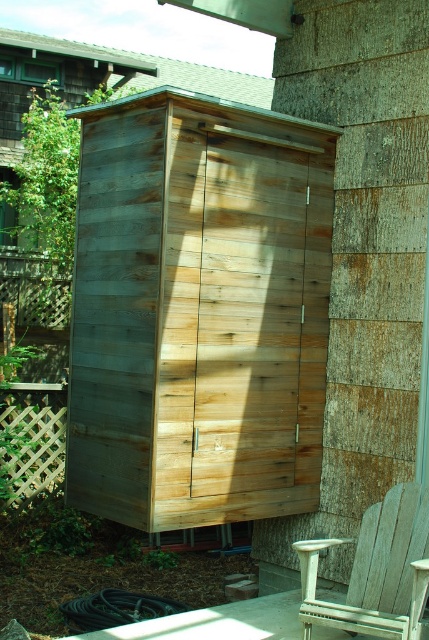
Question: Can you confirm if weathered wood shed at center is positioned below white weathered wood chair at lower right?

Choices:
 (A) no
 (B) yes

Answer: (A)

Question: Considering the relative positions of white weathered wood chair at lower right and wooden lattice at left in the image provided, where is white weathered wood chair at lower right located with respect to wooden lattice at left?

Choices:
 (A) right
 (B) left

Answer: (A)

Question: Which object appears closest to the camera in this image?

Choices:
 (A) wooden lattice at left
 (B) white weathered wood chair at lower right
 (C) weathered wood shed at center
 (D) green wood tree at upper left

Answer: (B)

Question: Considering the real-world distances, which object is farthest from the wooden lattice at left?

Choices:
 (A) white weathered wood chair at lower right
 (B) green wood tree at upper left

Answer: (A)

Question: Is weathered wood shed at center bigger than green wood tree at upper left?

Choices:
 (A) no
 (B) yes

Answer: (B)

Question: Among these objects, which one is farthest from the camera?

Choices:
 (A) wooden lattice at left
 (B) green wood tree at upper left
 (C) weathered wood shed at center
 (D) white weathered wood chair at lower right

Answer: (A)